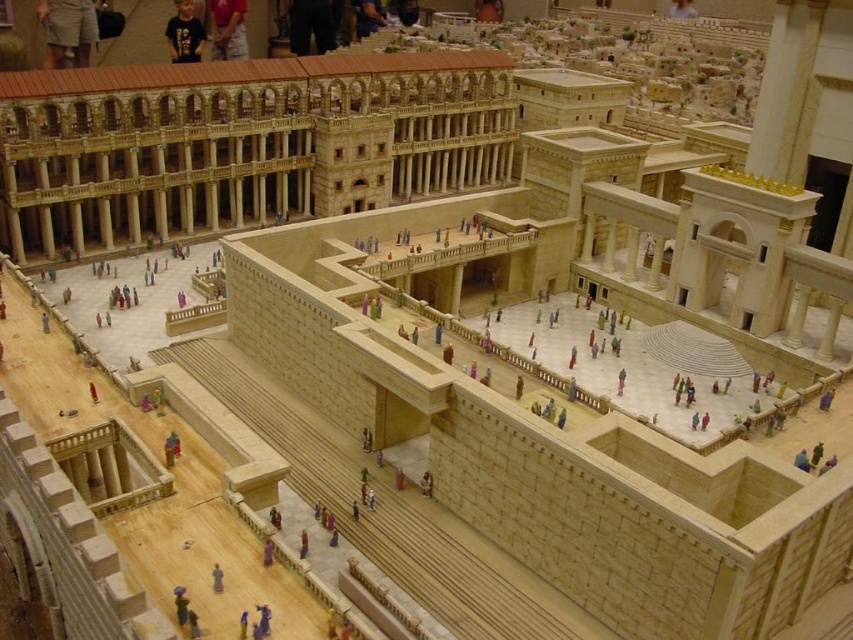
You are an architect examining the model of the historical complex. You notice the gray fabric figure at center and the purple fabric person at lower center. Which of these two figures is smaller in size?

The gray fabric figure at center is smaller in size compared to the purple fabric person at lower center.

You are an architect examining the model of the temple complex. You notice two elements in the model, the khaki shorts at upper left and the purple fabric person at lower center. Which of these two elements is larger in size?

The khaki shorts at upper left is bigger than the purple fabric person at lower center.

You are an architect examining the model and notice the khaki shorts at upper left and the gray fabric figure at center. Which object is placed higher in the model?

The khaki shorts at upper left is positioned over gray fabric figure at center, so it is placed higher.